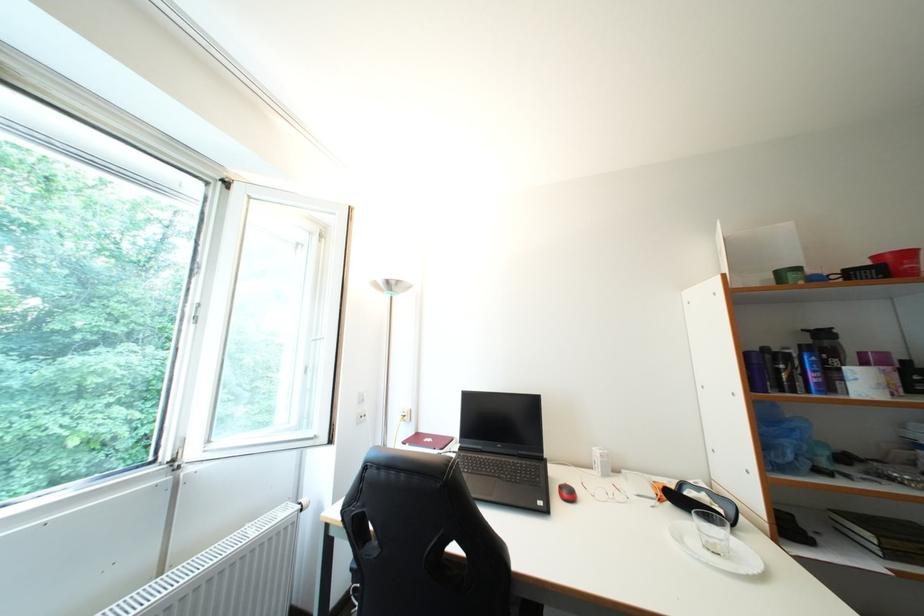
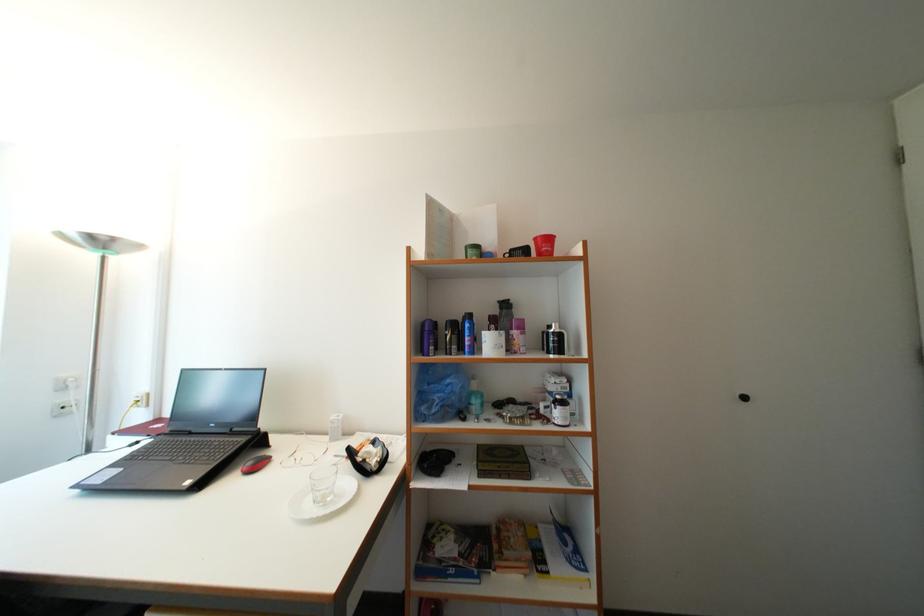
Question: What movement of the cameraman would produce the second image?

Choices:
 (A) Left
 (B) Right
 (C) Forward
 (D) Backward

Answer: (B)